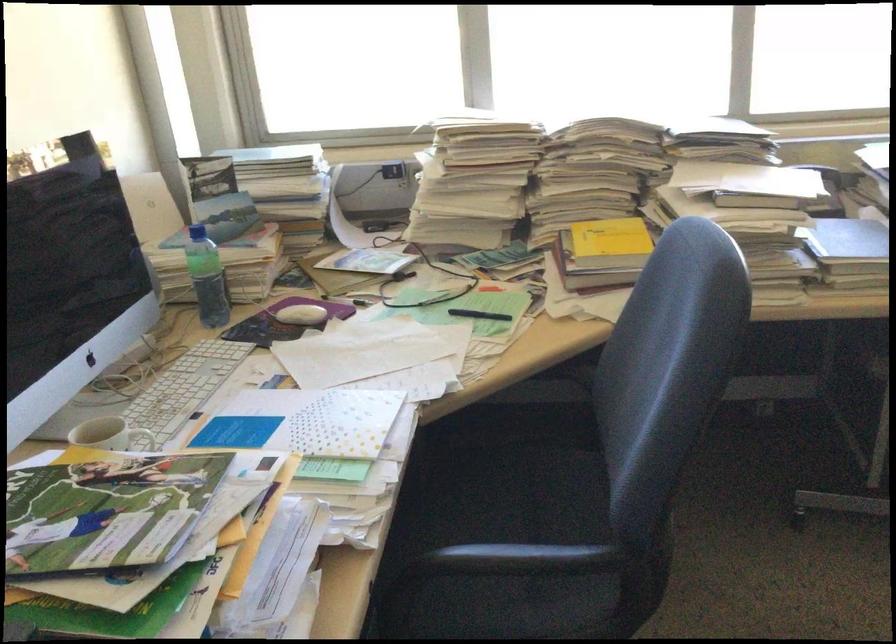
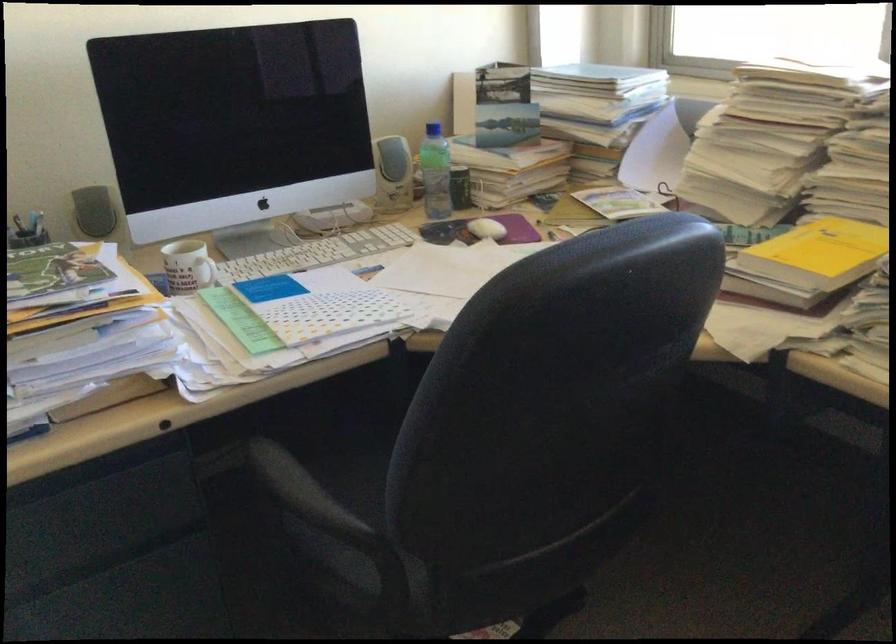
The point at (595, 569) is marked in the first image. Where is the corresponding point in the second image?

(314, 521)